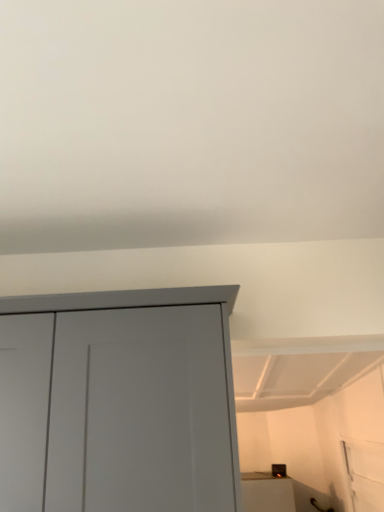
Locate an element on the screen. Image resolution: width=384 pixels, height=512 pixels. matte gray cupboard at upper left is located at coordinates [x=149, y=306].

This screenshot has width=384, height=512. Describe the element at coordinates (149, 306) in the screenshot. I see `matte gray cupboard at upper left` at that location.

The width and height of the screenshot is (384, 512). Find the location of `matte gray cupboard at upper left`. matte gray cupboard at upper left is located at coordinates (149, 306).